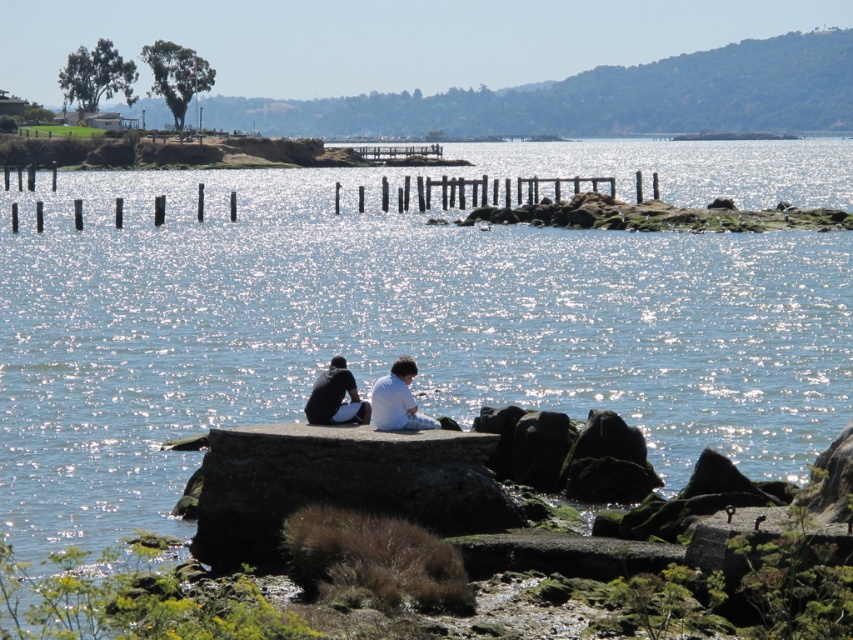
You are standing at the edge of the lake and want to reach the white matte shirt at center. Based on the coordinates provided, in which direction should you move from your current position to reach it?

The white matte shirt at center is located at coordinates point (397,400). Since the coordinate system is not specified, it is recommended to move towards the center of the lake where the shirt is positioned.

You are a photographer planning to capture the scene of the white fabric couple at center and the dark gray fabric shirt at lower center. Based on their height difference, which one would you focus on first to ensure they are both in frame?

The white fabric couple at center is much taller than the dark gray fabric shirt at lower center, so focusing on the white fabric couple at center first would ensure both are in frame as the taller subject occupies more space.